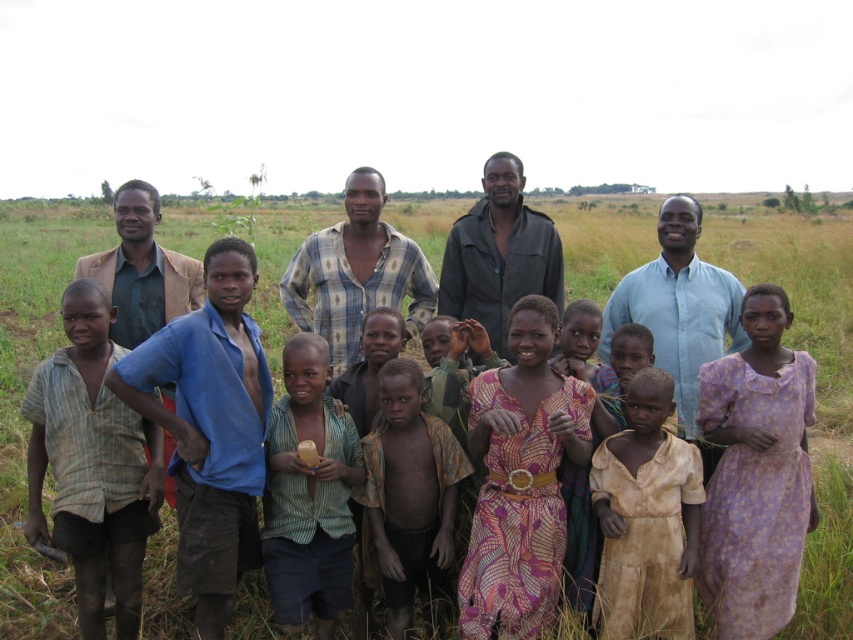
You are a photographer trying to capture a clear shot of both the brown textured dress at center and the brown textured shirt at center. Since they are both in the center, which one will appear larger in your photo?

The brown textured dress at center will appear larger in the photo because it is closer to the viewer than the brown textured shirt at center.

Based on the photo, you are standing at the point labeled as point (670, 378) in the image. There is a small tree 2.5 meters away from you in the direction of the nearest bush. Can you reach the tree without leaving the field?

The point labeled point (670, 378) is 3.60 meters away from the viewer. Since the tree is only 2.5 meters away from your current position, you can reach the tree without leaving the field as the distance is shorter than the total distance from the viewer.